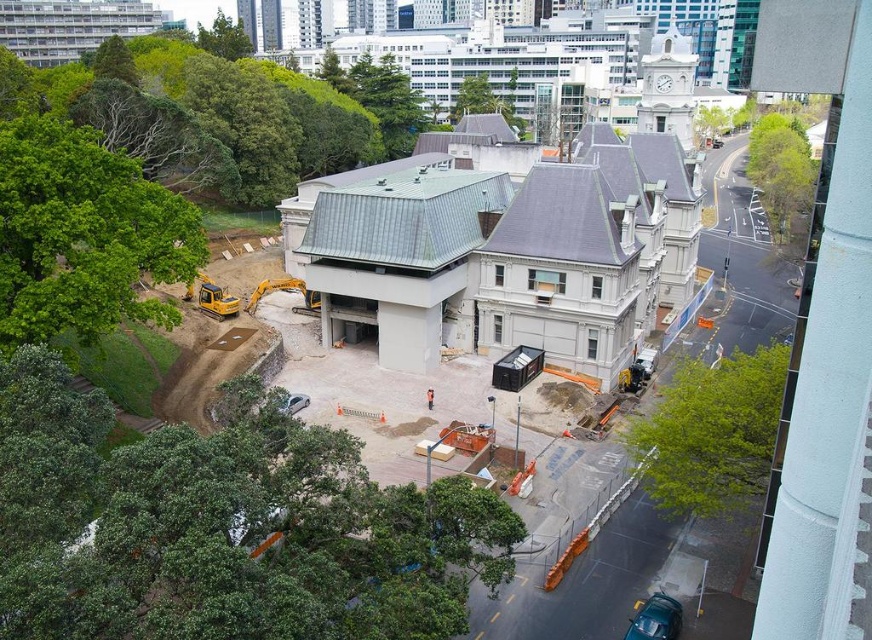
You are standing at point (38, 125) and want to walk to the entrance of the historic building under renovation. Is the entrance closer to you than 50 meters?

The entrance to the historic building under renovation is 44.24 meters away from point (38, 125), so yes, it is closer than 50 meters.

You are a pedestrian walking on the sidewalk near the construction site. You see the green leafy tree at upper left and the orange safety vest at center. Which object is closer to you?

The green leafy tree at upper left is closer to you because the orange safety vest at center is behind it.